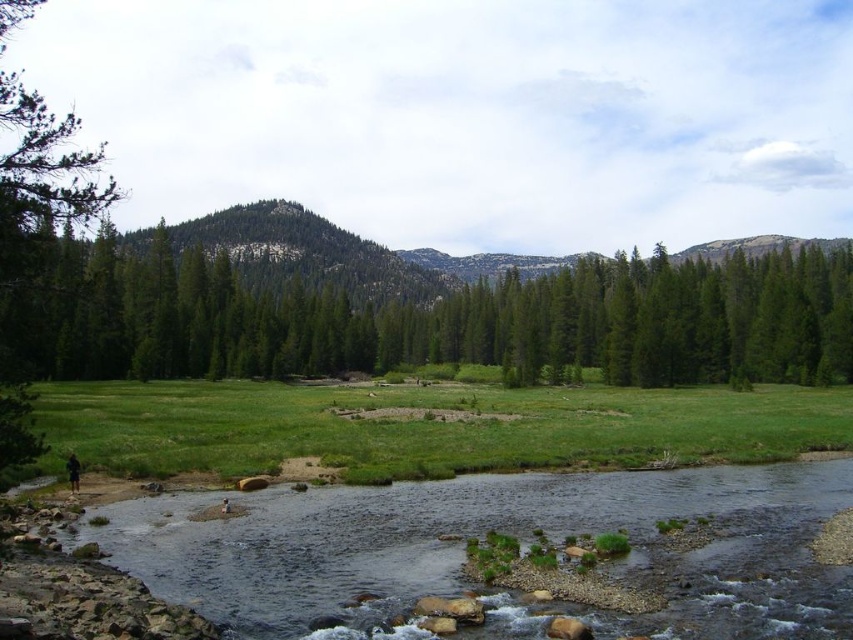
Locate an element on the screen. clear water at river center is located at coordinates (480, 536).

In the scene shown: Can you confirm if clear water at river center is taller than green grassy field at lower center?

In fact, clear water at river center may be shorter than green grassy field at lower center.

Is point (397, 580) closer to camera compared to point (242, 388)?

That is True.

Where is `clear water at river center`? This screenshot has height=640, width=853. clear water at river center is located at coordinates (x=480, y=536).

In the scene shown: How much distance is there between green matte tree at center and clear water at river center?

They are 70.04 meters apart.

Identify the location of green matte tree at center. (422, 317).

This screenshot has height=640, width=853. In order to click on green matte tree at center in this screenshot , I will do `click(422, 317)`.

Who is more forward, (x=672, y=378) or (x=412, y=429)?

Point (x=412, y=429) is in front.

Which is in front, point (743, 285) or point (813, 404)?

Positioned in front is point (813, 404).

Identify the location of green matte tree at center. [422, 317].